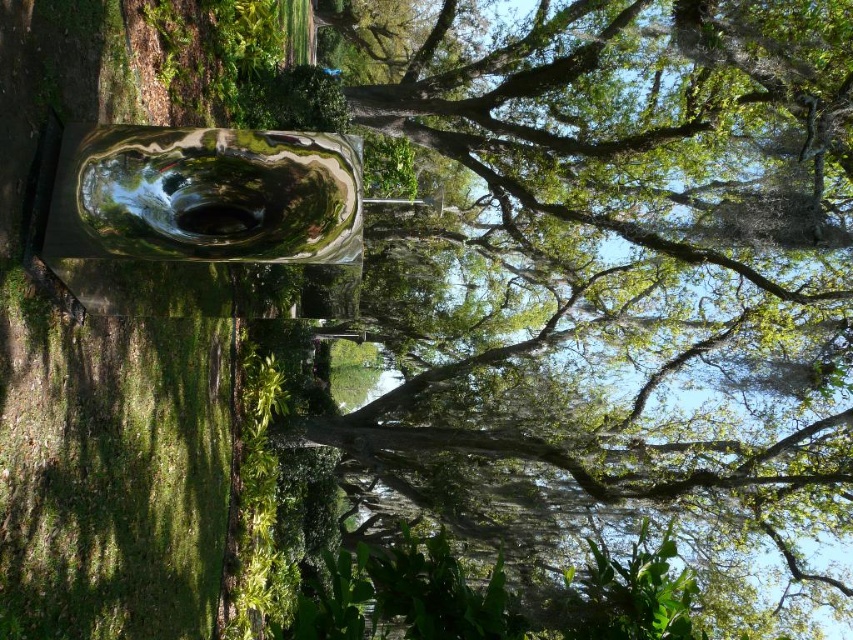
Is glossy metallic sculpture at center above metallic reflective pool at center?

Yes.

Consider the image. Is glossy metallic sculpture at center bigger than metallic reflective pool at center?

Yes.

Find the location of a particular element. This screenshot has height=640, width=853. glossy metallic sculpture at center is located at coordinates (625, 257).